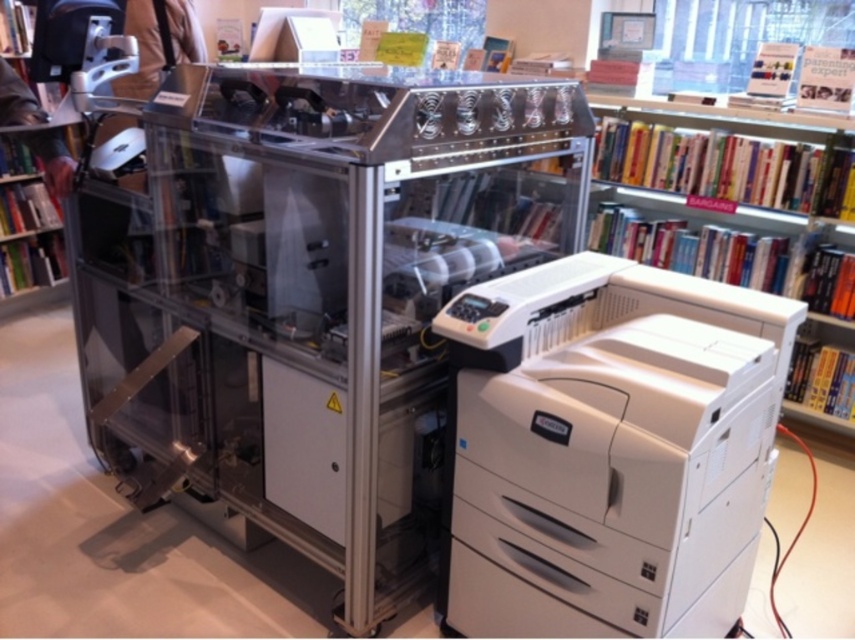
Does hardcover books at right appear on the left side of green matte bookshelf at lower left?

No, hardcover books at right is not to the left of green matte bookshelf at lower left.

Between hardcover books at right and green matte bookshelf at lower left, which one appears on the left side from the viewer's perspective?

green matte bookshelf at lower left is more to the left.

Between point (833, 339) and point (57, 193), which one is positioned behind?

Positioned behind is point (833, 339).

Identify the location of hardcover books at right. (735, 236).

Between point (516, 317) and point (762, 180), which one is positioned behind?

The point (762, 180) is more distant.

Is point (605, 632) farther from camera compared to point (599, 237)?

No, it is in front of (599, 237).

Which is in front, point (616, 304) or point (764, 234)?

Point (616, 304) is in front.

Locate an element on the screen. white plastic printer at center is located at coordinates (606, 449).

The image size is (855, 640). Describe the element at coordinates (606, 449) in the screenshot. I see `white plastic printer at center` at that location.

From the picture: Which is more to the left, white plastic printer at center or green matte bookshelf at lower left?

green matte bookshelf at lower left

Identify the location of white plastic printer at center. point(606,449).